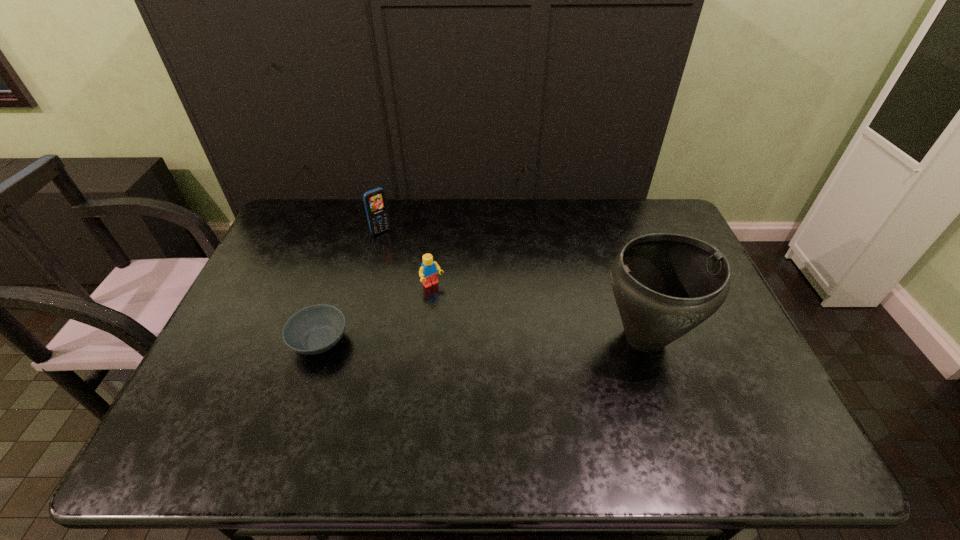
The width and height of the screenshot is (960, 540). I want to click on the shortest object, so click(315, 329).

Locate an element on the screen. urn is located at coordinates (665, 285).

The image size is (960, 540). In order to click on the tallest object in this screenshot , I will do `click(665, 285)`.

You are a GUI agent. You are given a task and a screenshot of the screen. Output one action in this format:
    pyautogui.click(x=<x>, y=<y>)
    Task: Click on the farthest object
    The width and height of the screenshot is (960, 540).
    Given the screenshot: What is the action you would take?
    pyautogui.click(x=375, y=203)

The height and width of the screenshot is (540, 960). What are the coordinates of `cellular telephone` in the screenshot? It's located at (375, 203).

You are a GUI agent. You are given a task and a screenshot of the screen. Output one action in this format:
    pyautogui.click(x=<x>, y=<y>)
    Task: Click on the Lego
    This screenshot has height=540, width=960.
    Given the screenshot: What is the action you would take?
    pyautogui.click(x=428, y=271)

The width and height of the screenshot is (960, 540). What are the coordinates of `the third object from left to right` in the screenshot? It's located at (428, 271).

Where is `vacant space located on the right of the shortest object`? The width and height of the screenshot is (960, 540). vacant space located on the right of the shortest object is located at coordinates (481, 341).

Find the location of a particular element. This screenshot has height=540, width=960. free space located on the back of the rightmost object is located at coordinates (606, 224).

I want to click on free spot located 0.330m on the screen of the second tallest object, so click(x=438, y=292).